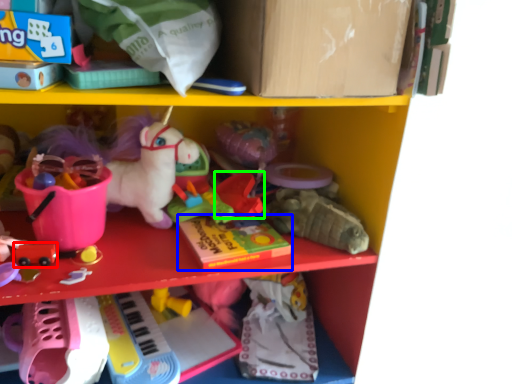
Question: Which object is the closest to the toy (highlighted by a red box)? Choose among these: book (highlighted by a blue box) or toy (highlighted by a green box).

Choices:
 (A) book
 (B) toy

Answer: (A)